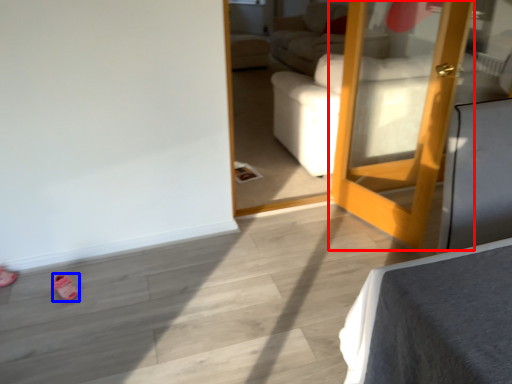
Question: Which object appears closest to the camera in this image, door (highlighted by a red box) or shoe (highlighted by a blue box)?

Choices:
 (A) door
 (B) shoe

Answer: (A)